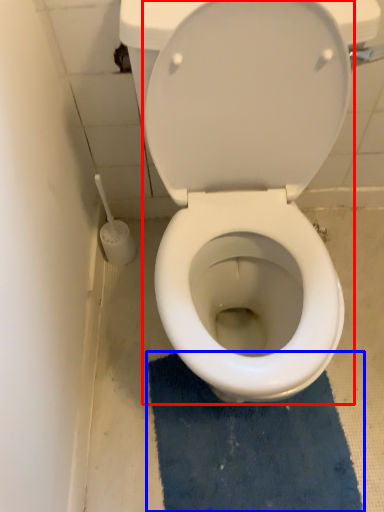
Question: Which object is further to the camera taking this photo, toilet (highlighted by a red box) or bath mat (highlighted by a blue box)?

Choices:
 (A) toilet
 (B) bath mat

Answer: (B)